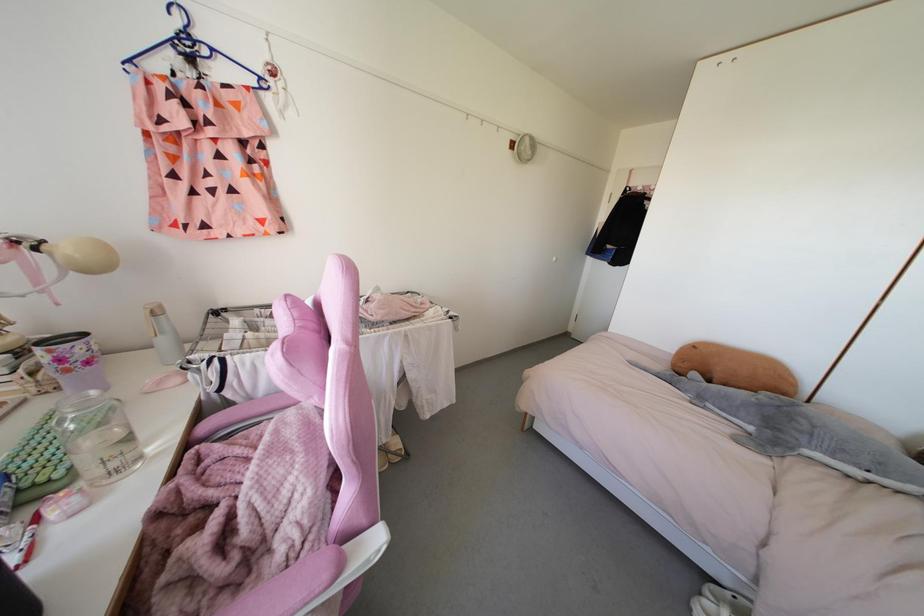
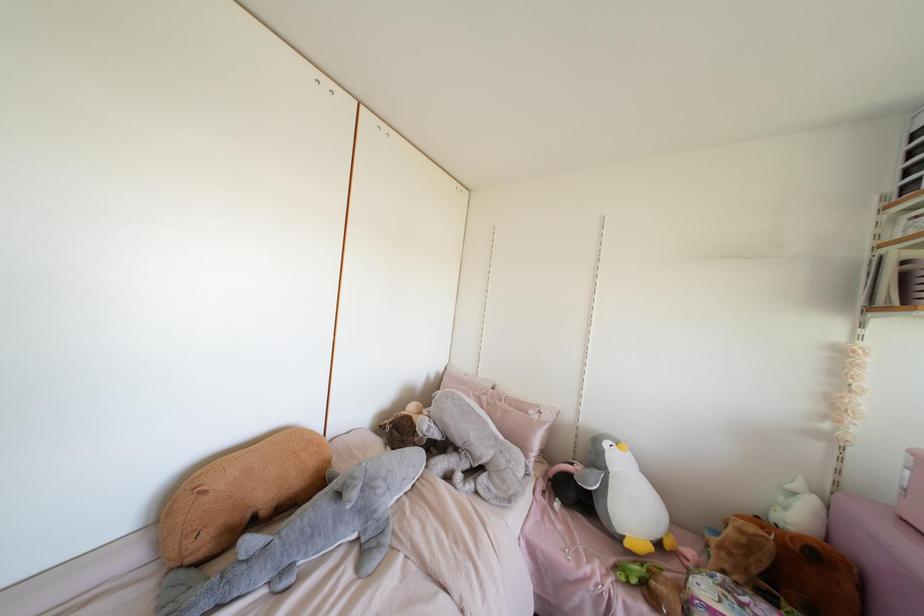
Where in the second image is the point corresponding to (x=843, y=450) from the first image?

(403, 479)